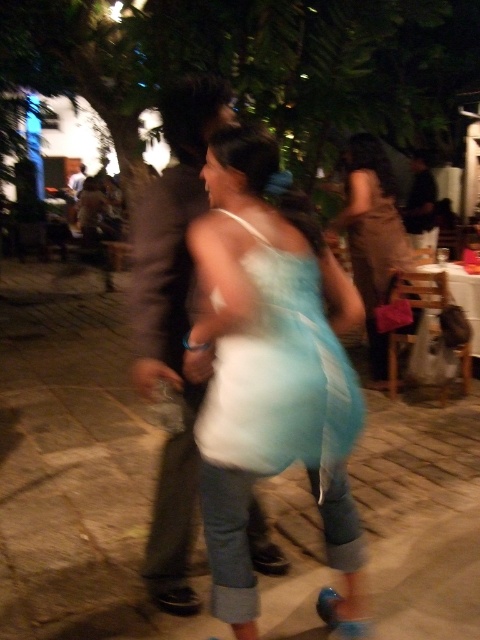
Which of these two, dark brown suit at center or light blue satin dress at center, stands shorter?

light blue satin dress at center

Is point (145, 209) farther from viewer compared to point (256, 403)?

That is True.

The image size is (480, 640). I want to click on dark brown suit at center, so click(172, 323).

Does light blue fabric dress at center appear on the right side of matte brown dress at center?

Incorrect, light blue fabric dress at center is not on the right side of matte brown dress at center.

In order to click on light blue fabric dress at center in this screenshot , I will do `click(268, 381)`.

Does light blue fabric dress at center have a greater width compared to dark brown suit at center?

Indeed, light blue fabric dress at center has a greater width compared to dark brown suit at center.

Which is more to the left, light blue fabric dress at center or dark brown suit at center?

Positioned to the left is dark brown suit at center.

The width and height of the screenshot is (480, 640). Find the location of `light blue fabric dress at center`. light blue fabric dress at center is located at coordinates (268, 381).